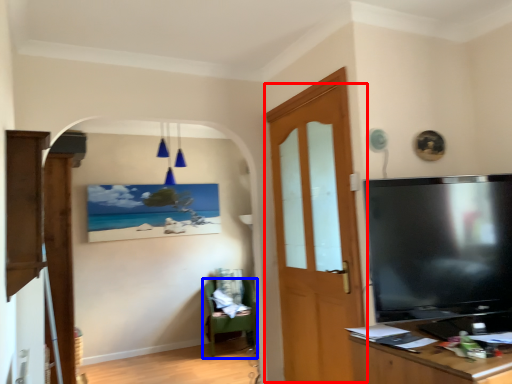
Question: Which object is further to the camera taking this photo, door (highlighted by a red box) or chair (highlighted by a blue box)?

Choices:
 (A) door
 (B) chair

Answer: (B)